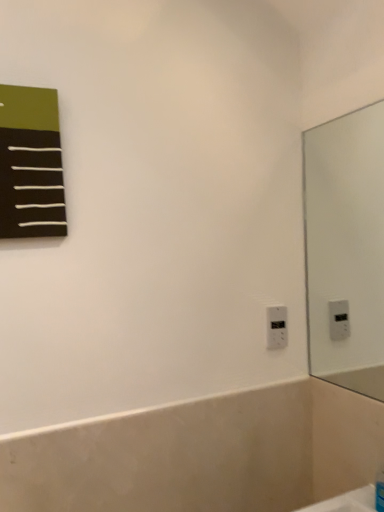
Locate an element on the screen. This screenshot has height=512, width=384. white plastic electric outlet at lower right is located at coordinates (276, 327).

What do you see at coordinates (276, 327) in the screenshot? The image size is (384, 512). I see `white plastic electric outlet at lower right` at bounding box center [276, 327].

The image size is (384, 512). In order to click on white plastic electric outlet at lower right in this screenshot , I will do `click(276, 327)`.